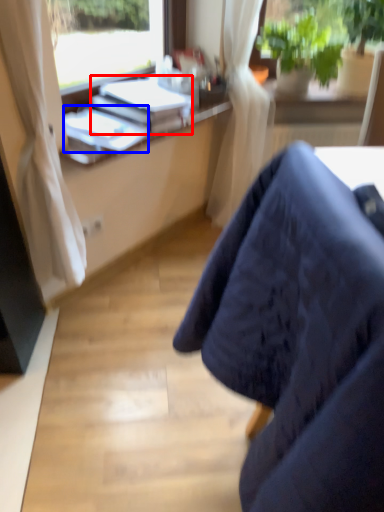
Question: Which of the following is the closest to the observer, book (highlighted by a red box) or book (highlighted by a blue box)?

Choices:
 (A) book
 (B) book

Answer: (B)